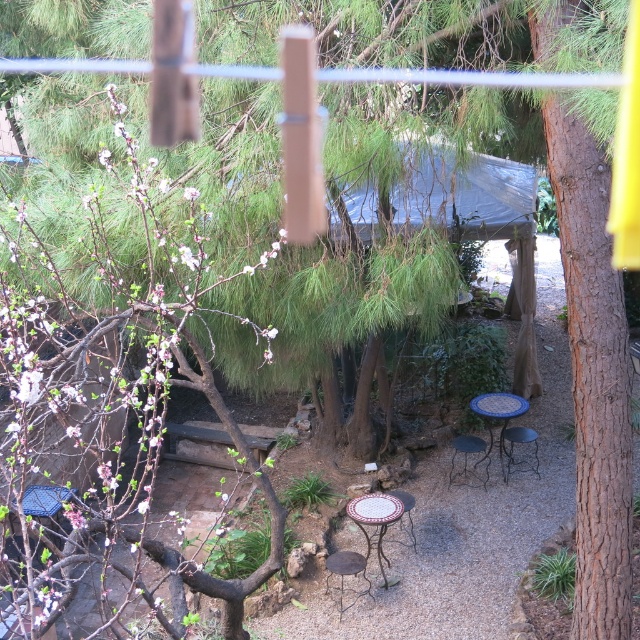
Question: Is brown rough bark tree at right above metallic black chair at center?

Choices:
 (A) no
 (B) yes

Answer: (B)

Question: Among these objects, which one is nearest to the camera?

Choices:
 (A) brown rough bark tree at right
 (B) blue mosaic table at center

Answer: (A)

Question: Which object is the closest to the metallic mosaic table at center?

Choices:
 (A) brown rough bark tree at right
 (B) metallic stool at center

Answer: (B)

Question: Observing the image, what is the correct spatial positioning of metallic black chair at center in reference to porcelain ceramic table at center?

Choices:
 (A) left
 (B) right

Answer: (B)

Question: Does metallic stool at center appear on the right side of metallic black chair at center?

Choices:
 (A) no
 (B) yes

Answer: (A)

Question: Which object is farther from the camera taking this photo?

Choices:
 (A) metallic black chair at center
 (B) blue mosaic table at center

Answer: (A)